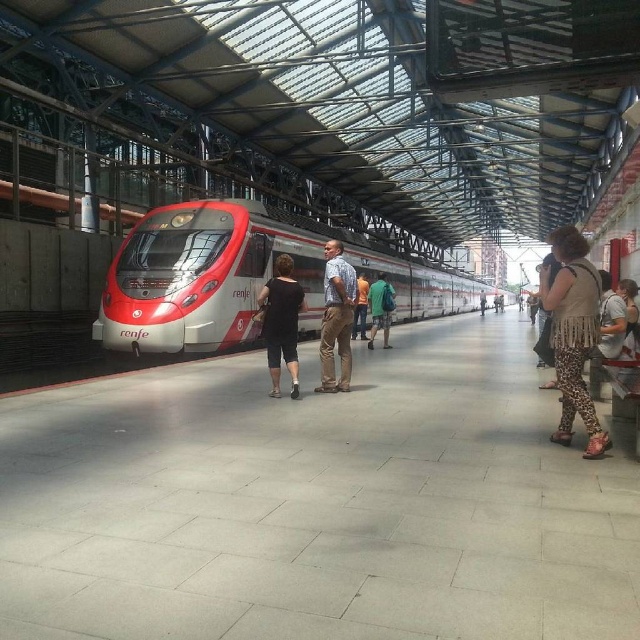
Question: Which of these objects is positioned farthest from the silver metallic train at center?

Choices:
 (A) leather jacket at right
 (B) leather jacket at center

Answer: (B)

Question: Which object appears closest to the camera in this image?

Choices:
 (A) black matte shirt at center
 (B) leather jacket at right
 (C) silver metallic train at center

Answer: (B)

Question: Can you confirm if black matte shirt at center is smaller than orange t-shirt at center?

Choices:
 (A) no
 (B) yes

Answer: (B)

Question: Which of the following is the closest to the observer?

Choices:
 (A) leather jacket at center
 (B) green fabric backpack at center
 (C) orange t-shirt at center

Answer: (C)

Question: Can you confirm if black matte shirt at center is wider than orange t-shirt at center?

Choices:
 (A) no
 (B) yes

Answer: (A)

Question: Can you confirm if leopard print pants at right is positioned to the left of orange t-shirt at center?

Choices:
 (A) yes
 (B) no

Answer: (B)